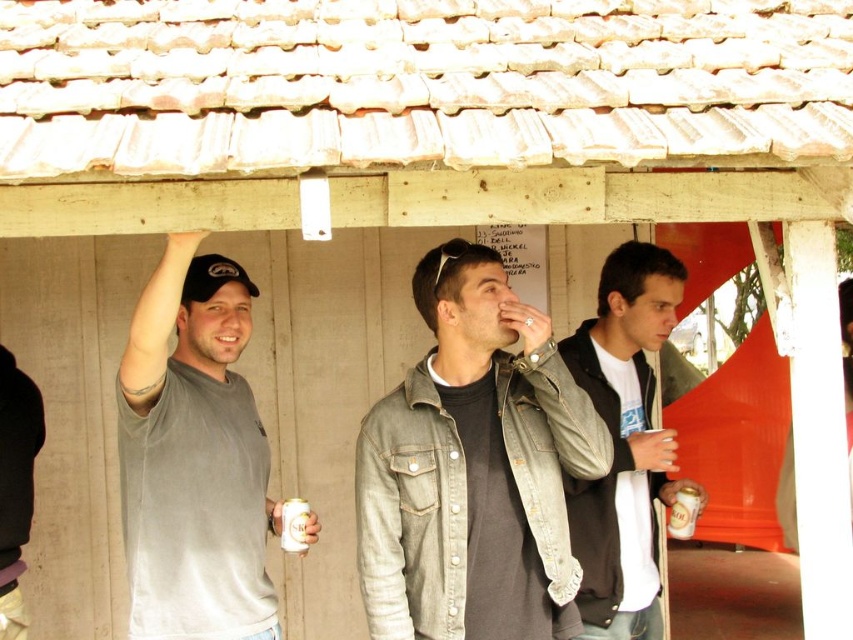
You are standing at the entrance of the wooden structure and want to hand a can to the person wearing the denim jacket at center. Which direction should you move to reach them?

The denim jacket at center is located at point [473,468], so you should move towards the center area where the denim jacket at center is positioned.

You are trying to decide which clothing item to take for a casual outing. Based on the image, which clothing item is shorter in height between the denim jacket at center and the dark gray hoodie at center?

The denim jacket at center is shorter in height than the dark gray hoodie at center.